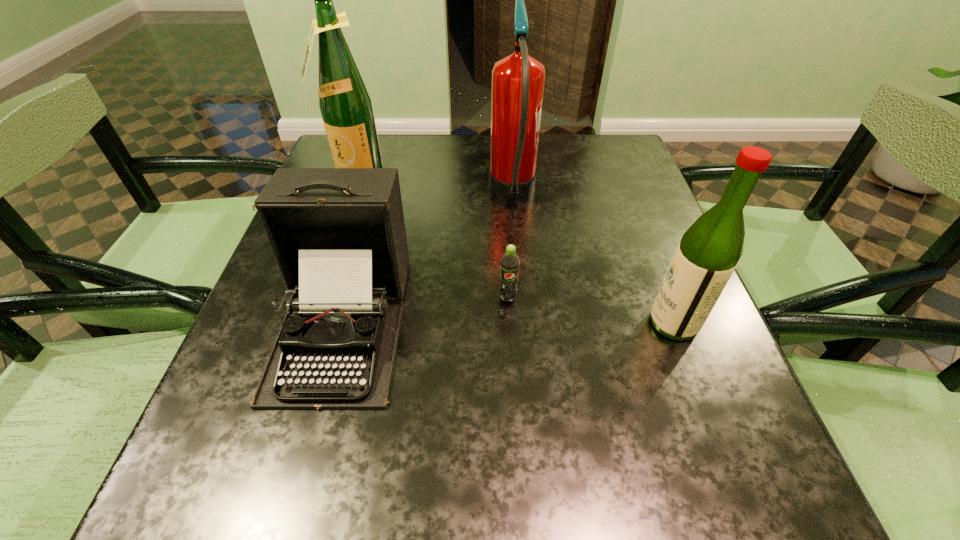
Where is `vacant space at the far edge of the desktop`? The height and width of the screenshot is (540, 960). vacant space at the far edge of the desktop is located at coordinates (465, 139).

Locate an element on the screen. vacant point at the near edge is located at coordinates (328, 512).

Identify the location of free space at the left edge of the desktop. (298, 450).

Identify the location of vacant region at the right edge of the desktop. (637, 364).

This screenshot has width=960, height=540. In order to click on free space at the far left corner in this screenshot , I will do `click(382, 149)`.

Locate an element on the screen. This screenshot has width=960, height=540. vacant position at the near left corner of the desktop is located at coordinates (251, 462).

The width and height of the screenshot is (960, 540). In order to click on vacant area at the far right corner of the desktop in this screenshot , I will do `click(619, 139)`.

At what (x,y) coordinates should I click in order to perform the action: click on blank space at the near right corner. Please return your answer as a coordinate pair (x, y). The height and width of the screenshot is (540, 960). Looking at the image, I should click on pos(671,455).

What are the coordinates of `vacant area between the fire extinguisher and the typewriter` in the screenshot? It's located at (428, 257).

Where is `free space between the shortest object and the taller liquor`? free space between the shortest object and the taller liquor is located at coordinates (432, 238).